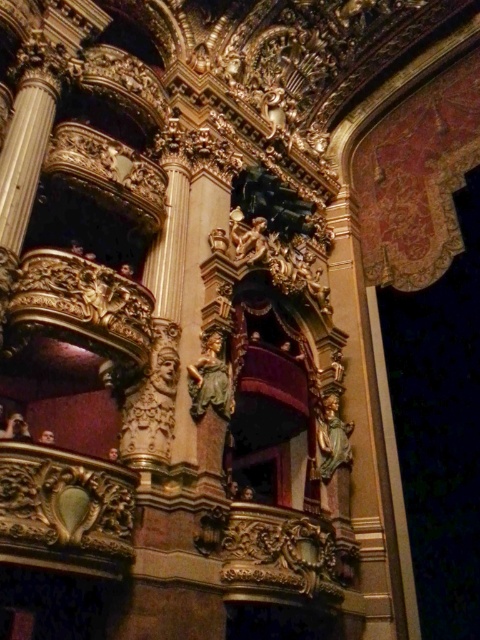
You are an interior designer examining the theater balcony. You see the green marble statue at center and the golden polished statue at center. Which one is positioned to the left?

The green marble statue at center is positioned to the left of the golden polished statue at center.

You are an interior designer planning to install a new lighting fixture above the green marble statue at center and the golden polished statue at center. Which statue requires a taller fixture to avoid casting a shadow on its head?

The golden polished statue at center requires a taller lighting fixture because it is taller than the green marble statue at center, so a taller fixture would prevent its head from casting a shadow.